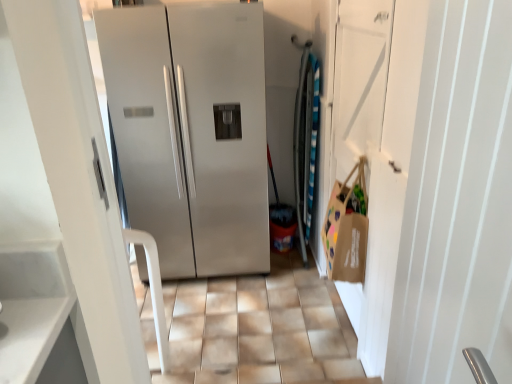
Find the location of a particular element. The width and height of the screenshot is (512, 384). satin silver refrigerator at center is located at coordinates (192, 131).

Measure the distance between point [399,77] and camera.

They are 1.50 meters apart.

In order to face brown paper bag at right, should I rotate leftwards or rightwards?

A 11.183 degree turn to the right will do.

Where is `satin silver refrigerator at center`? The width and height of the screenshot is (512, 384). satin silver refrigerator at center is located at coordinates (192, 131).

From a real-world perspective, is brown paper bag at right physically located above or below brown paper bag at right?

From a real-world perspective, brown paper bag at right is physically above brown paper bag at right.

Between brown paper bag at right and brown paper bag at right, which one is positioned in front?

brown paper bag at right is in front.

How different are the orientations of brown paper bag at right and brown paper bag at right in degrees?

1.11 degrees.

Does point (340, 209) appear closer or farther from the camera than point (387, 314)?

Point (340, 209).

From a real-world perspective, which object stands above the other?

From a 3D spatial view, brown paper bag at right is above.

Which of these two, brown paper bag at right or brown paper bag at right, is bigger?

brown paper bag at right is bigger.

Considering the relative sizes of brown paper bag at right and satin silver refrigerator at center in the image provided, is brown paper bag at right thinner than satin silver refrigerator at center?

Correct, the width of brown paper bag at right is less than that of satin silver refrigerator at center.

Which point is more forward, [361,280] or [190,272]?

The point [361,280] is closer.

Looking at this image, from the image's perspective, between brown paper bag at right and satin silver refrigerator at center, which one is located above?

satin silver refrigerator at center appears higher in the image.

Considering the relative sizes of brown paper bag at right and satin silver refrigerator at center in the image provided, is brown paper bag at right taller than satin silver refrigerator at center?

No.

Considering the positions of objects satin silver refrigerator at center and brown paper bag at right in the image provided, who is more to the right, satin silver refrigerator at center or brown paper bag at right?

Positioned to the right is brown paper bag at right.

Is the surface of satin silver refrigerator at center in direct contact with brown paper bag at right?

No.

Is satin silver refrigerator at center shorter than brown paper bag at right?

Incorrect, the height of satin silver refrigerator at center does not fall short of that of brown paper bag at right.

From a real-world perspective, is satin silver refrigerator at center positioned over brown paper bag at right based on gravity?

Incorrect, from a real-world perspective, satin silver refrigerator at center is lower than brown paper bag at right.

Is point (369, 338) closer or farther from the camera than point (193, 111)?

Point (369, 338).

Considering the sizes of objects brown paper bag at right and satin silver refrigerator at center in the image provided, who is shorter, brown paper bag at right or satin silver refrigerator at center?

brown paper bag at right.

Which object is positioned more to the right, brown paper bag at right or satin silver refrigerator at center?

Positioned to the right is brown paper bag at right.

Is brown paper bag at right facing away from satin silver refrigerator at center?

brown paper bag at right is not turned away from satin silver refrigerator at center.

Can you confirm if satin silver refrigerator at center is smaller than brown paper bag at right?

Actually, satin silver refrigerator at center might be larger than brown paper bag at right.

Could you tell me if satin silver refrigerator at center is facing brown paper bag at right?

No, satin silver refrigerator at center does not turn towards brown paper bag at right.

From the image's perspective, which is above, satin silver refrigerator at center or brown paper bag at right?

From the image's view, satin silver refrigerator at center is above.

Find the location of a particular element. This screenshot has height=384, width=512. door that appears above the brown paper bag at right (from the image's perspective) is located at coordinates (377, 146).

Where is `door in front of the brown paper bag at right`? door in front of the brown paper bag at right is located at coordinates (377, 146).

From the image, which object appears to be nearer to brown paper bag at right, satin silver refrigerator at center or brown paper bag at right?

brown paper bag at right is positioned closer to the anchor brown paper bag at right.

Looking at the image, which one is located further to brown paper bag at right, satin silver refrigerator at center or brown paper bag at right?

satin silver refrigerator at center.

Based on their spatial positions, is brown paper bag at right or brown paper bag at right further from satin silver refrigerator at center?

Based on the image, brown paper bag at right appears to be further to satin silver refrigerator at center.

Estimate the real-world distances between objects in this image. Which object is further from satin silver refrigerator at center, brown paper bag at right or brown paper bag at right?

Among the two, brown paper bag at right is located further to satin silver refrigerator at center.

When comparing their distances from brown paper bag at right, does brown paper bag at right or satin silver refrigerator at center seem closer?

brown paper bag at right.

Looking at the image, which one is located further to brown paper bag at right, brown paper bag at right or satin silver refrigerator at center?

satin silver refrigerator at center lies further to brown paper bag at right than the other object.

At what (x,y) coordinates should I click in order to perform the action: click on shopping bag situated between satin silver refrigerator at center and brown paper bag at right from left to right. Please return your answer as a coordinate pair (x, y). Looking at the image, I should click on (347, 229).